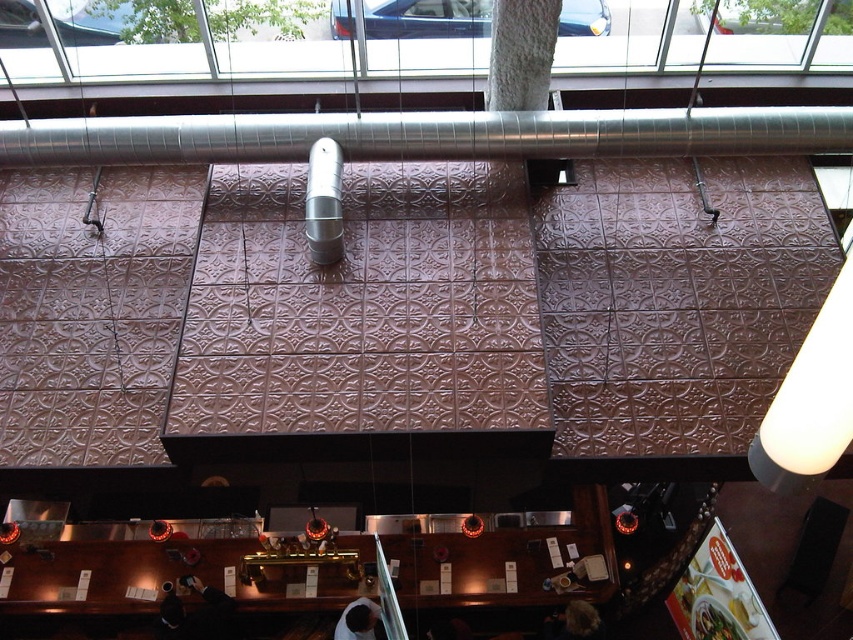
Question: Among these points, which one is nearest to the camera?

Choices:
 (A) (770, 122)
 (B) (828, 442)

Answer: (B)

Question: Among these objects, which one is nearest to the camera?

Choices:
 (A) white matte lampshade at upper right
 (B) silver metallic exhaust hood at upper center

Answer: (A)

Question: Observing the image, what is the correct spatial positioning of silver metallic exhaust hood at upper center in reference to white matte lampshade at upper right?

Choices:
 (A) above
 (B) below

Answer: (A)

Question: Does silver metallic exhaust hood at upper center lie in front of white matte lampshade at upper right?

Choices:
 (A) no
 (B) yes

Answer: (A)

Question: Can you confirm if silver metallic exhaust hood at upper center is positioned below white matte lampshade at upper right?

Choices:
 (A) no
 (B) yes

Answer: (A)